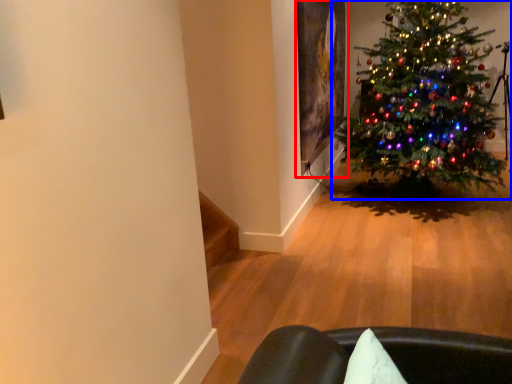
Question: Which of the following is the closest to the observer, picture frame (highlighted by a red box) or christmas tree (highlighted by a blue box)?

Choices:
 (A) picture frame
 (B) christmas tree

Answer: (B)